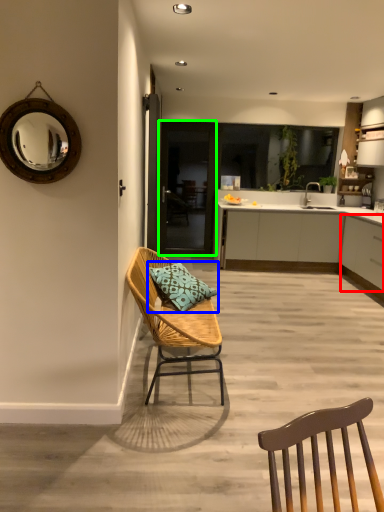
Question: Estimate the real-world distances between objects in this image. Which object is closer to cabinetry (highlighted by a red box), pillow (highlighted by a blue box) or glass door (highlighted by a green box)?

Choices:
 (A) pillow
 (B) glass door

Answer: (A)